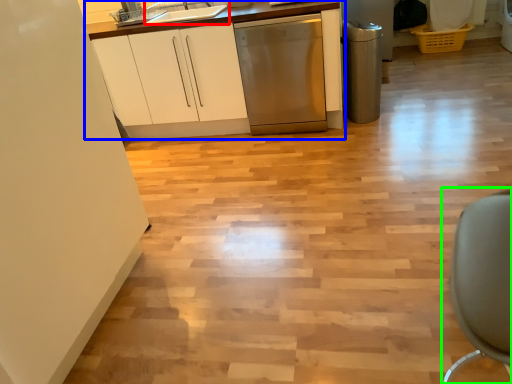
Question: Based on their relative distances, which object is farther from sink (highlighted by a red box)? Choose from cabinetry (highlighted by a blue box) and swivel chair (highlighted by a green box).

Choices:
 (A) cabinetry
 (B) swivel chair

Answer: (B)